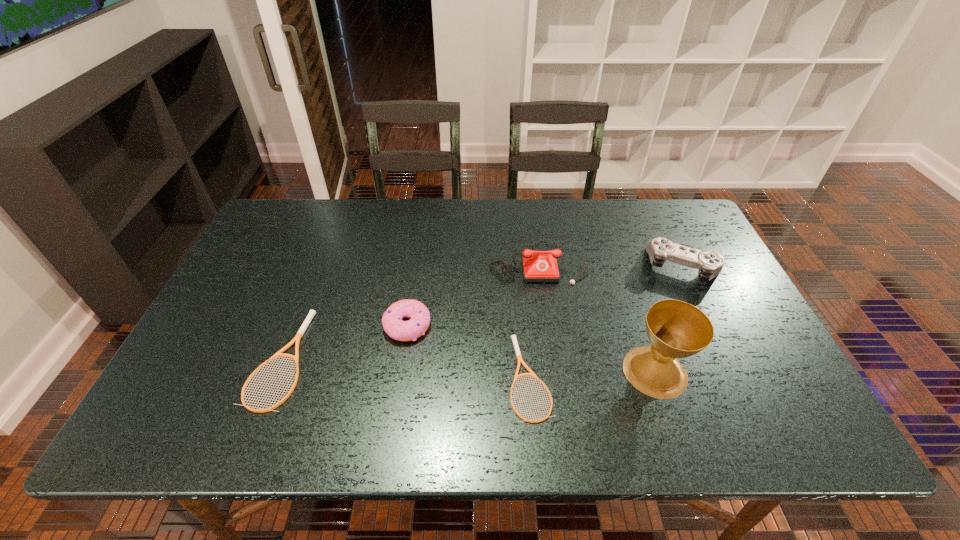
The image size is (960, 540). In order to click on free space between the telephone and the rightmost object in this screenshot , I will do `click(611, 264)`.

Locate an element on the screen. The height and width of the screenshot is (540, 960). unoccupied position between the telephone and the control is located at coordinates (611, 264).

Locate an element on the screen. The width and height of the screenshot is (960, 540). vacant space in between the doughnut and the rightmost object is located at coordinates (545, 296).

This screenshot has width=960, height=540. In order to click on vacant area that lies between the tallest object and the left tennis racket in this screenshot , I will do `click(468, 365)`.

Find the location of a particular element. The width and height of the screenshot is (960, 540). free space between the fifth object from left to right and the fifth object from right to left is located at coordinates (531, 349).

The width and height of the screenshot is (960, 540). I want to click on free point between the doughnut and the rightmost object, so click(545, 296).

Find the location of `free spot between the right tennis racket and the telephone`. free spot between the right tennis racket and the telephone is located at coordinates (534, 320).

Locate an element on the screen. The width and height of the screenshot is (960, 540). free space between the doughnut and the second shortest object is located at coordinates (344, 342).

This screenshot has height=540, width=960. In order to click on the fourth closest object to the control in this screenshot , I will do `click(393, 325)`.

You are a GUI agent. You are given a task and a screenshot of the screen. Output one action in this format:
    pyautogui.click(x=<x>, y=<y>)
    Task: Click on the fifth closest object to the shortest object
    This screenshot has width=960, height=540.
    Given the screenshot: What is the action you would take?
    pyautogui.click(x=311, y=314)